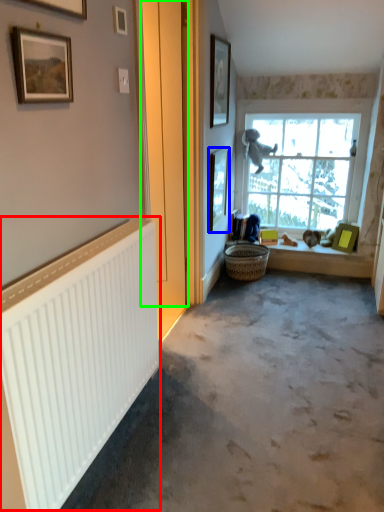
Question: Which object is the closest to the radiator (highlighted by a red box)? Choose among these: picture frame (highlighted by a blue box) or door (highlighted by a green box).

Choices:
 (A) picture frame
 (B) door

Answer: (B)